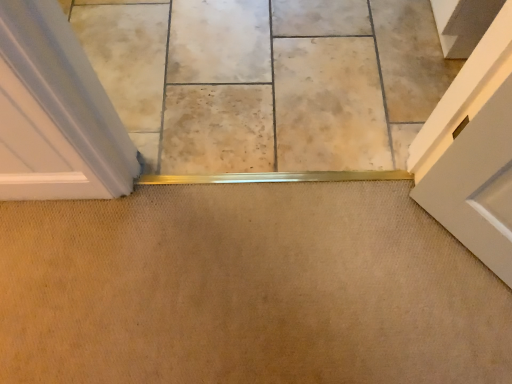
The width and height of the screenshot is (512, 384). Describe the element at coordinates (268, 81) in the screenshot. I see `beige ceramic tile at center` at that location.

You are a GUI agent. You are given a task and a screenshot of the screen. Output one action in this format:
    pyautogui.click(x=<x>, y=<y>)
    Task: Click on the beige ceramic tile at center
    
    Given the screenshot: What is the action you would take?
    pyautogui.click(x=268, y=81)

What are the coordinates of `beige ceramic tile at center` in the screenshot? It's located at (268, 81).